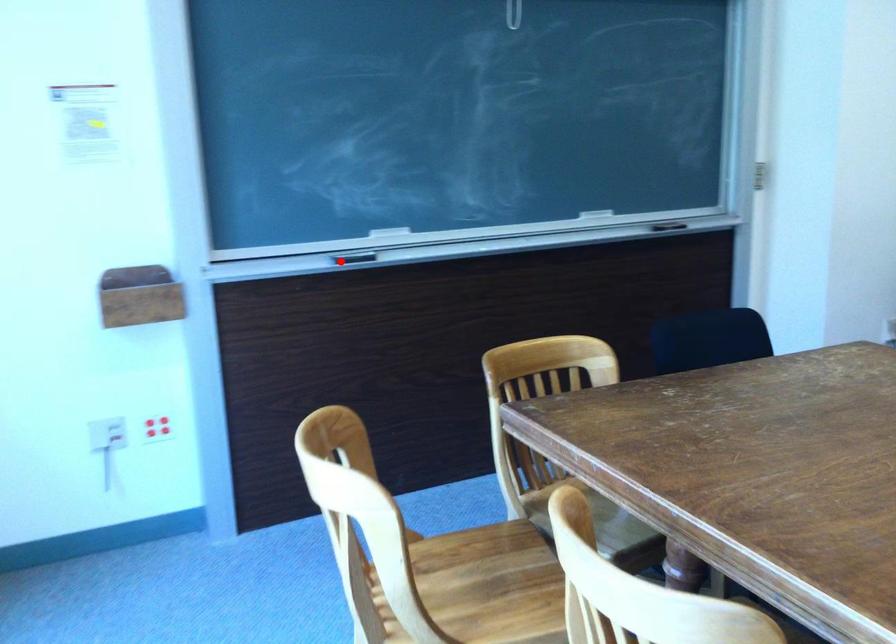
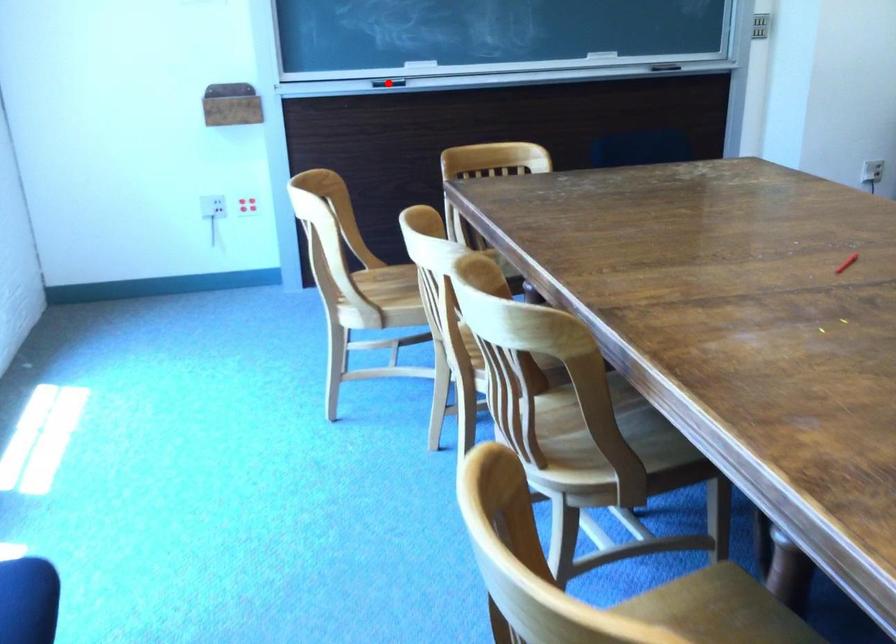
I am providing you with two images of the same scene from different viewpoints. A red point is marked on the first image and another point is marked on the second image. Do the highlighted points in image1 and image2 indicate the same real-world spot?

Yes